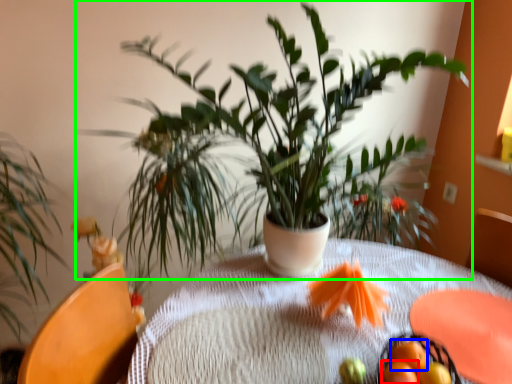
Question: Estimate the real-world distances between objects in this image. Which object is closer to tangerine (highlighted by a red box), tangerine (highlighted by a blue box) or houseplant (highlighted by a green box)?

Choices:
 (A) tangerine
 (B) houseplant

Answer: (A)